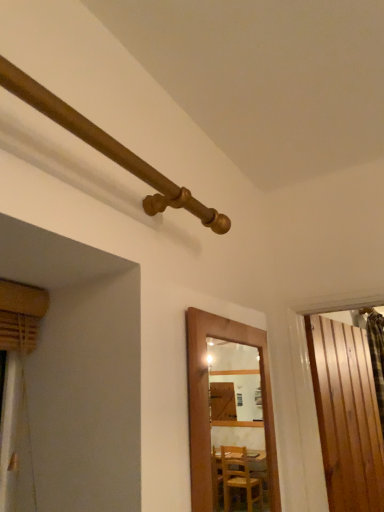
Question: Is wooden door at center, which appears as the 2th door when viewed from the back, wider than wooden pipe at upper left?

Choices:
 (A) no
 (B) yes

Answer: (A)

Question: Is wooden door at center, marked as the first door in a front-to-back arrangement, at the left side of wooden pipe at upper left?

Choices:
 (A) yes
 (B) no

Answer: (B)

Question: Does wooden door at center, marked as the first door in a front-to-back arrangement, turn towards wooden pipe at upper left?

Choices:
 (A) yes
 (B) no

Answer: (B)

Question: Would you consider wooden door at center, which is counted as the first door, starting from the left, to be distant from wooden pipe at upper left?

Choices:
 (A) no
 (B) yes

Answer: (A)

Question: Does wooden door at center, which is counted as the first door, starting from the left, touch wooden pipe at upper left?

Choices:
 (A) no
 (B) yes

Answer: (A)

Question: Considering the positions of wooden slats at right, the second door viewed from the front, and wooden pipe at upper left in the image, is wooden slats at right, the second door viewed from the front, taller or shorter than wooden pipe at upper left?

Choices:
 (A) tall
 (B) short

Answer: (A)

Question: Is wooden slats at right, positioned as the first door in right-to-left order, wider or thinner than wooden pipe at upper left?

Choices:
 (A) wide
 (B) thin

Answer: (B)

Question: From a real-world perspective, is wooden slats at right, positioned as the first door in right-to-left order, above or below wooden pipe at upper left?

Choices:
 (A) below
 (B) above

Answer: (A)

Question: Is wooden slats at right, the 2th door when ordered from left to right, inside the boundaries of wooden pipe at upper left, or outside?

Choices:
 (A) outside
 (B) inside

Answer: (A)

Question: Is point (268, 386) closer or farther from the camera than point (344, 508)?

Choices:
 (A) farther
 (B) closer

Answer: (B)

Question: Is wooden door at center, marked as the first door in a front-to-back arrangement, inside or outside of wooden slats at right, placed as the 1th door when sorted from back to front?

Choices:
 (A) inside
 (B) outside

Answer: (B)

Question: In terms of width, does wooden door at center, which appears as the 2th door when viewed from the back, look wider or thinner when compared to wooden slats at right, positioned as the first door in right-to-left order?

Choices:
 (A) wide
 (B) thin

Answer: (B)

Question: Looking at the image, does wooden door at center, which appears as the 2th door when viewed from the back, seem bigger or smaller compared to wooden slats at right, the second door viewed from the front?

Choices:
 (A) small
 (B) big

Answer: (A)

Question: In terms of height, does wooden pipe at upper left look taller or shorter compared to wooden door at center, which is counted as the first door, starting from the left?

Choices:
 (A) short
 (B) tall

Answer: (A)

Question: Looking at the image, does wooden pipe at upper left seem bigger or smaller compared to wooden door at center, which appears as the 2th door when viewed from the back?

Choices:
 (A) small
 (B) big

Answer: (A)